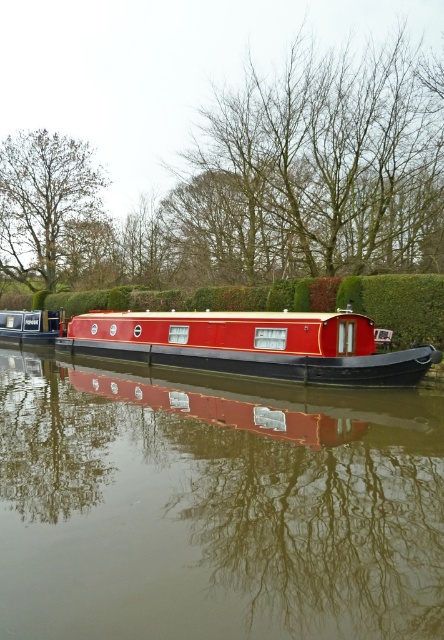
Question: Does shiny red boat at center have a larger size compared to brown leafy tree at upper left?

Choices:
 (A) no
 (B) yes

Answer: (A)

Question: Does glossy red boat at center have a larger size compared to brown leafless trees at upper center?

Choices:
 (A) no
 (B) yes

Answer: (A)

Question: Which point appears farthest from the camera in this image?

Choices:
 (A) (222, 346)
 (B) (32, 129)
 (C) (4, 330)

Answer: (B)

Question: Which of these objects is positioned farthest from the shiny red boat at center?

Choices:
 (A) brown leafy tree at upper left
 (B) matte black cabin at left
 (C) brown leafless trees at upper center
 (D) glossy red boat at center

Answer: (A)

Question: Which object is closer to the camera taking this photo?

Choices:
 (A) brown leafless trees at upper center
 (B) matte black cabin at left
 (C) brown leafy tree at upper left

Answer: (A)

Question: Can you confirm if shiny red boat at center is positioned to the right of matte black cabin at left?

Choices:
 (A) no
 (B) yes

Answer: (B)